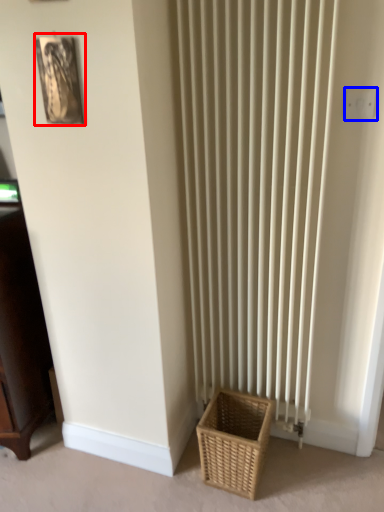
Question: Which object is closer to the camera taking this photo, picture frame (highlighted by a red box) or electric outlet (highlighted by a blue box)?

Choices:
 (A) picture frame
 (B) electric outlet

Answer: (A)